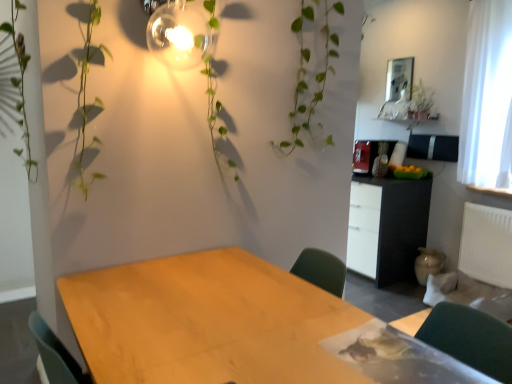
Question: Does white sheer curtain at right have a smaller size compared to black matte cabinet at center right?

Choices:
 (A) no
 (B) yes

Answer: (B)

Question: Is white sheer curtain at right facing away from black matte cabinet at center right?

Choices:
 (A) no
 (B) yes

Answer: (A)

Question: Could you tell me if white sheer curtain at right is turned towards black matte cabinet at center right?

Choices:
 (A) yes
 (B) no

Answer: (B)

Question: Does white sheer curtain at right lie in front of black matte cabinet at center right?

Choices:
 (A) yes
 (B) no

Answer: (A)

Question: Does white sheer curtain at right contain black matte cabinet at center right?

Choices:
 (A) yes
 (B) no

Answer: (B)

Question: In terms of height, does white plastic radiator at right look taller or shorter compared to black matte cabinet at center right?

Choices:
 (A) tall
 (B) short

Answer: (B)

Question: Considering their positions, is white plastic radiator at right located in front of or behind black matte cabinet at center right?

Choices:
 (A) behind
 (B) front

Answer: (B)

Question: From the image's perspective, is white plastic radiator at right above or below black matte cabinet at center right?

Choices:
 (A) above
 (B) below

Answer: (B)

Question: Is white plastic radiator at right to the left or to the right of black matte cabinet at center right in the image?

Choices:
 (A) left
 (B) right

Answer: (B)

Question: From a real-world perspective, is white sheer curtain at right positioned above or below matte glass light fixture at upper center?

Choices:
 (A) below
 (B) above

Answer: (A)

Question: Visually, is white sheer curtain at right positioned to the left or to the right of matte glass light fixture at upper center?

Choices:
 (A) right
 (B) left

Answer: (A)

Question: Is point (478, 92) closer or farther from the camera than point (148, 31)?

Choices:
 (A) farther
 (B) closer

Answer: (A)

Question: Is white sheer curtain at right in front of or behind matte glass light fixture at upper center in the image?

Choices:
 (A) behind
 (B) front

Answer: (A)

Question: Considering the positions of matte glass light fixture at upper center and black matte cabinet at center right in the image, is matte glass light fixture at upper center taller or shorter than black matte cabinet at center right?

Choices:
 (A) short
 (B) tall

Answer: (A)

Question: In the image, is matte glass light fixture at upper center positioned in front of or behind black matte cabinet at center right?

Choices:
 (A) front
 (B) behind

Answer: (A)